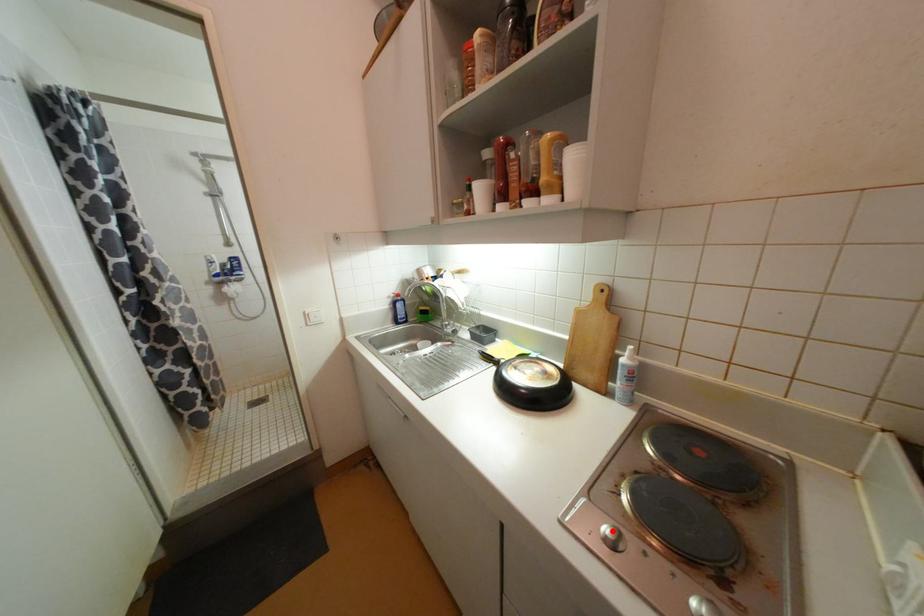
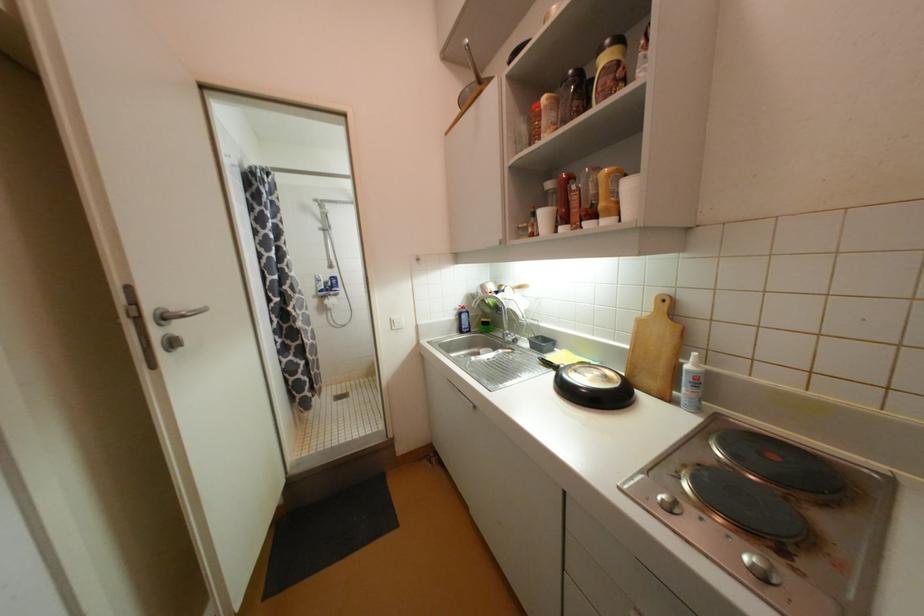
In the second image, find the point that corresponds to the highlighted location in the first image.

(669, 498)